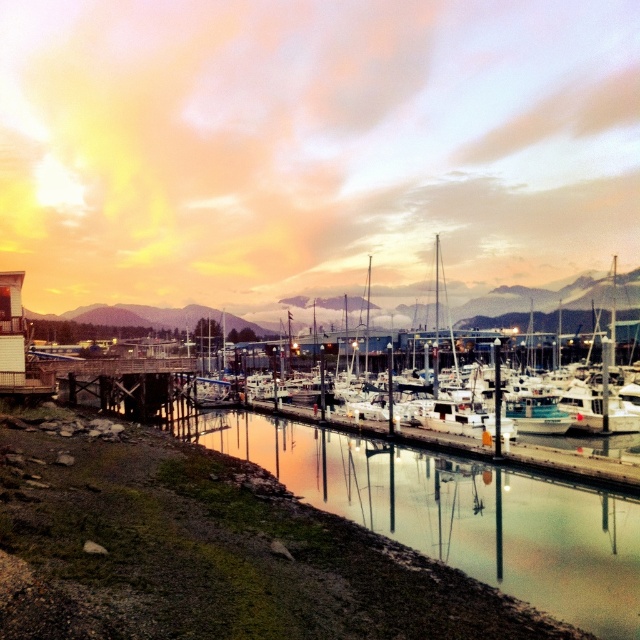
Question: Among these points, which one is nearest to the camera?

Choices:
 (A) (429, 307)
 (B) (138, 369)

Answer: (B)

Question: Is white matte boat at center to the right of wooden dock at lower left from the viewer's perspective?

Choices:
 (A) yes
 (B) no

Answer: (A)

Question: Which point is closer to the camera taking this photo?

Choices:
 (A) (65, 388)
 (B) (586, 326)

Answer: (A)

Question: Is white matte boat at center wider than wooden dock at lower left?

Choices:
 (A) yes
 (B) no

Answer: (A)

Question: Is white matte boat at center wider than wooden dock at lower left?

Choices:
 (A) no
 (B) yes

Answer: (B)